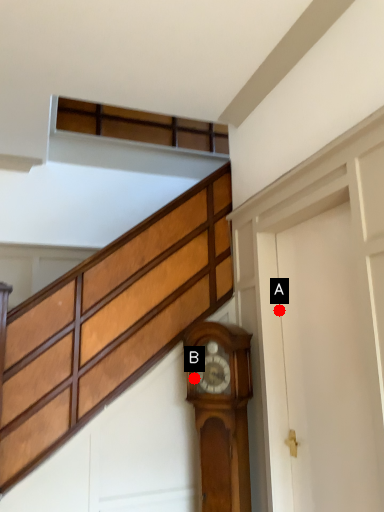
Question: Two points are circled on the image, labeled by A and B beside each circle. Which point is farther from the camera taking this photo?

Choices:
 (A) A is further
 (B) B is further

Answer: (A)